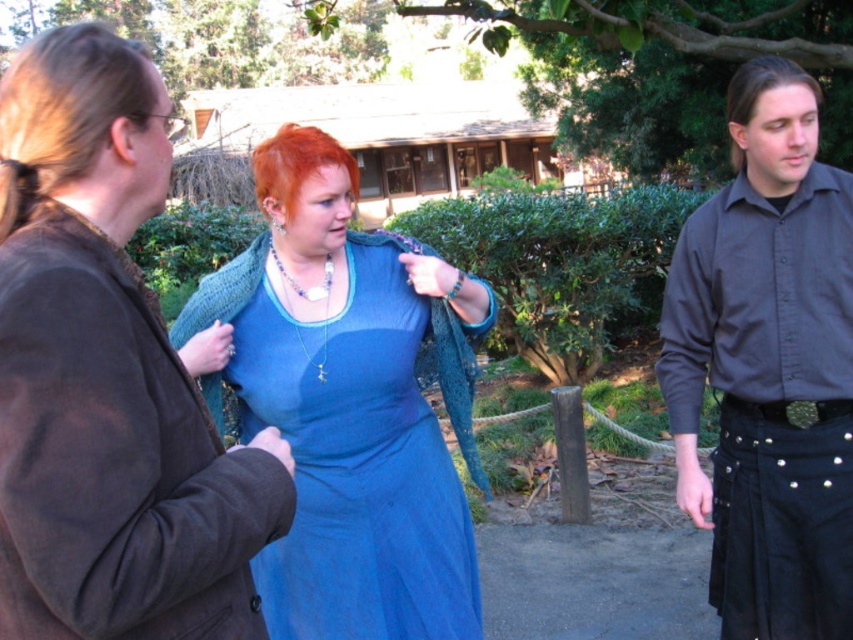
What do you see at coordinates (346, 403) in the screenshot?
I see `knitted teal shawl at center` at bounding box center [346, 403].

Who is positioned more to the right, knitted teal shawl at center or green metallic belt at lower right?

Positioned to the right is green metallic belt at lower right.

Identify the location of knitted teal shawl at center. pyautogui.click(x=346, y=403).

Which is in front, point (44, 224) or point (793, 403)?

Point (44, 224)

Is blue knitted scarf at center to the right of green metallic belt at lower right from the viewer's perspective?

In fact, blue knitted scarf at center is to the left of green metallic belt at lower right.

Is point (125, 317) positioned after point (807, 412)?

No, (125, 317) is closer to viewer.

This screenshot has width=853, height=640. Find the location of `blue knitted scarf at center`. blue knitted scarf at center is located at coordinates (108, 376).

Who is shorter, knitted teal shawl at center or black denim kilt at lower right?

With less height is black denim kilt at lower right.

Who is taller, knitted teal shawl at center or black denim kilt at lower right?

Standing taller between the two is knitted teal shawl at center.

What do you see at coordinates (346, 403) in the screenshot? I see `knitted teal shawl at center` at bounding box center [346, 403].

Locate an element on the screen. The width and height of the screenshot is (853, 640). knitted teal shawl at center is located at coordinates (346, 403).